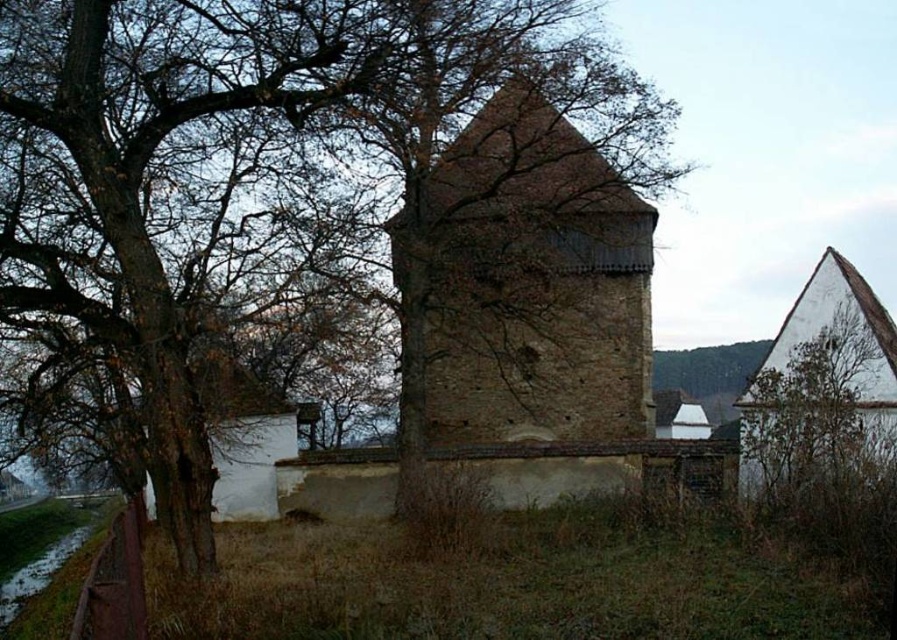
You are standing at the base of the stone tower and notice two points marked on the ground. The first point is at coordinates point (545, 406) and the second is at point (787, 445). From your vantage point, which point is closer to you?

Point (787, 445) is closer to you because it is in front of point (545, 406).

You are a painter standing at the edge of the overgrown grassy area. You want to paint a scene where both the brown rough bark tree at center and the brown stone church tower at center are visible. Which object should you position closer to the foreground to ensure both are fully visible in your painting?

You should position the brown rough bark tree at center closer to the foreground because it might be wider than the brown stone church tower at center, allowing both to fit within the painting without overlapping excessively.

You are standing in front of the brown stone church tower at center and want to see the view behind it. Can you see the brown rough bark tree at center from your current position?

The brown rough bark tree at center is in front of the brown stone church tower at center, so you cannot see the view behind the brown stone church tower at center from your current position because the tree is blocking it.